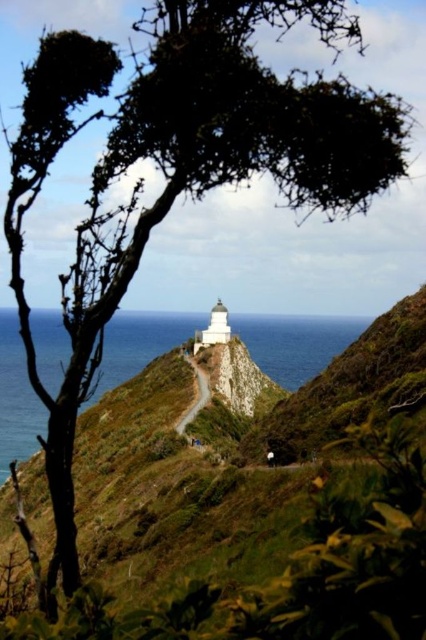
You are standing at the base of the cliff looking towards the lighthouse. There is a point marked at coordinates (296,342) in the image. What is located at this point?

The point at coordinates (296,342) corresponds to blue water at center.

You are a hiker who wants to take a photo of the blue water at center from the smooth concrete path at center. Based on their relative sizes in the image, which object would appear larger in your camera view?

The blue water at center appears larger in the camera view because it is much taller than the smooth concrete path at center.